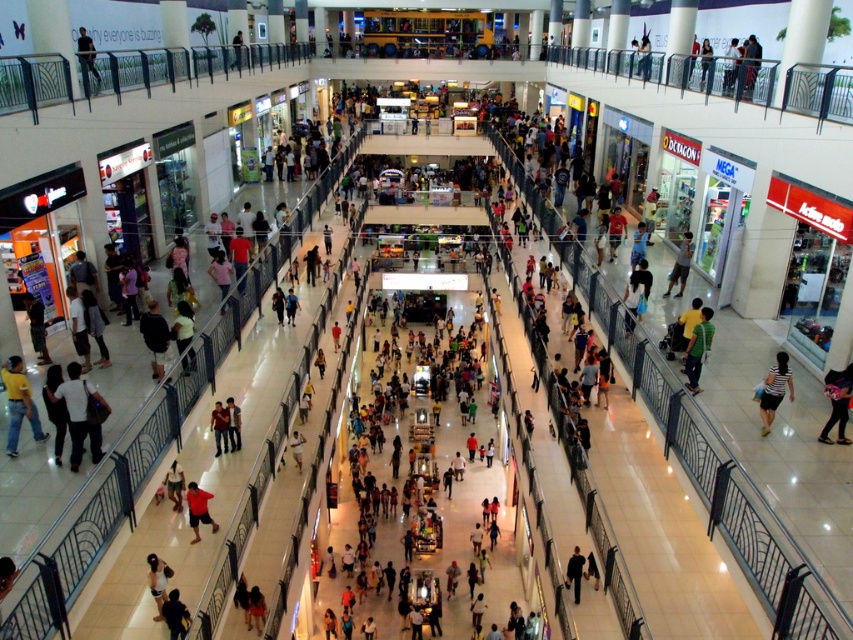
Question: Is yellow t-shirt at lower left bigger than matte black jacket at upper left?

Choices:
 (A) no
 (B) yes

Answer: (A)

Question: Does yellow t-shirt at lower left have a larger size compared to white fabric shirt at center?

Choices:
 (A) yes
 (B) no

Answer: (A)

Question: Which of these objects is positioned farthest from the matte black jacket at upper left?

Choices:
 (A) dark blue jacket at center
 (B) yellow t-shirt at lower left

Answer: (A)

Question: Among these points, which one is nearest to the camera?

Choices:
 (A) (155, 566)
 (B) (167, 497)
 (C) (569, 563)
 (D) (685, 243)

Answer: (A)

Question: Where is yellow t-shirt at lower left located in relation to light blue denim jeans at center in the image?

Choices:
 (A) left
 (B) right

Answer: (A)

Question: Which of the following is the closest to the observer?

Choices:
 (A) green matte shirt at center
 (B) yellow t-shirt at lower left
 (C) light brown fabric dress at center

Answer: (B)